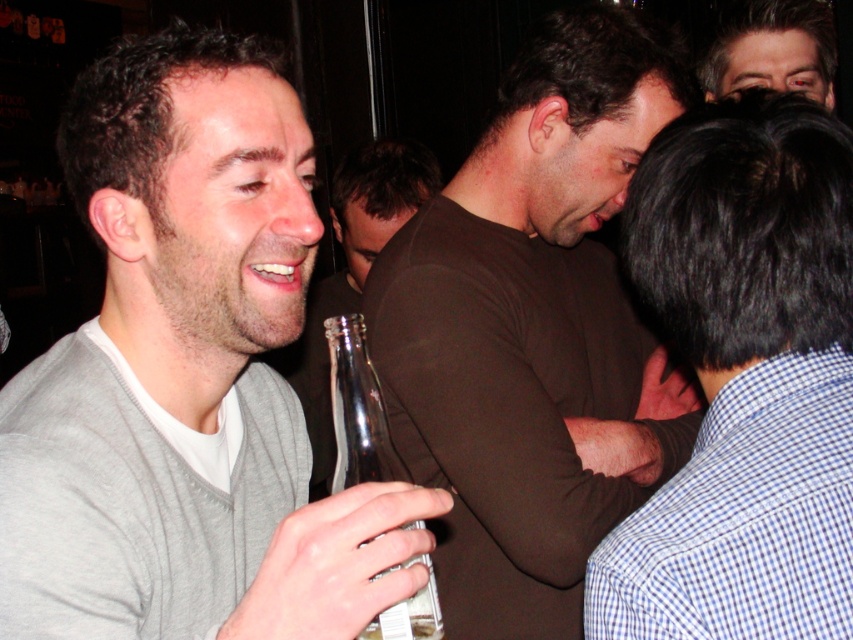
Question: Does gray sweater at center have a larger size compared to smooth brown hair at upper right?

Choices:
 (A) no
 (B) yes

Answer: (B)

Question: Estimate the real-world distances between objects in this image. Which object is farther from the blue checkered shirt at center?

Choices:
 (A) smooth brown hair at upper right
 (B) clear glass bottle at lower left

Answer: (A)

Question: Which point is farther to the camera?

Choices:
 (A) (370, 412)
 (B) (497, 563)
 (C) (383, 161)

Answer: (C)

Question: Is brown matte shirt at center positioned behind blue checkered shirt at center?

Choices:
 (A) no
 (B) yes

Answer: (B)

Question: Is gray sweater at center bigger than smooth brown hair at upper right?

Choices:
 (A) no
 (B) yes

Answer: (B)

Question: Which object is the closest to the matte gray sweater at left?

Choices:
 (A) smooth brown hair at upper right
 (B) blue checkered shirt at center
 (C) clear glass bottle at lower left

Answer: (A)